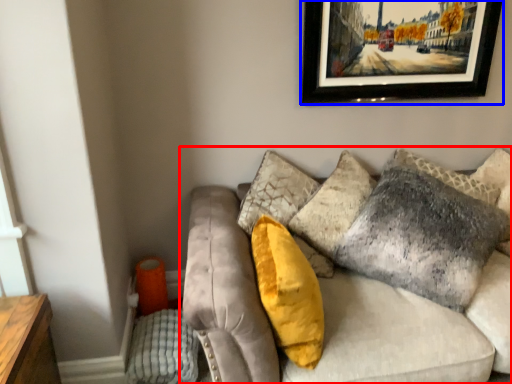
Question: Which point is closer to the camera, studio couch (highlighted by a red box) or picture frame (highlighted by a blue box)?

Choices:
 (A) studio couch
 (B) picture frame

Answer: (A)